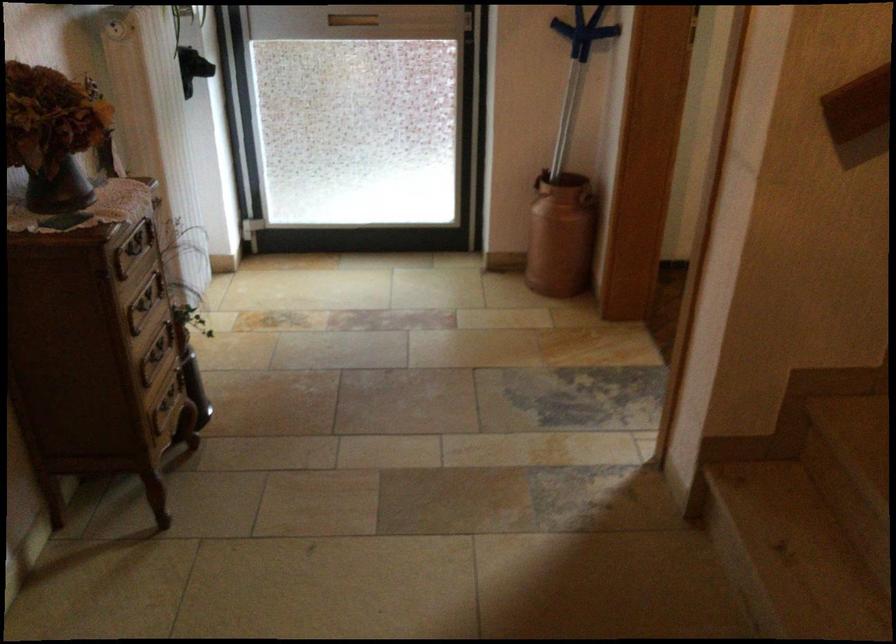
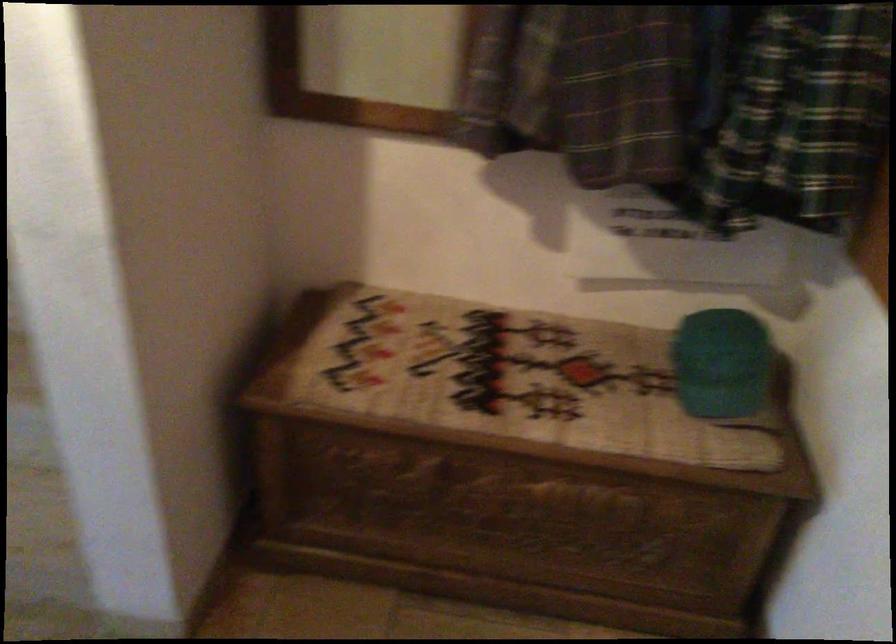
How did the camera likely rotate?

The rotation direction of the camera is right-down.